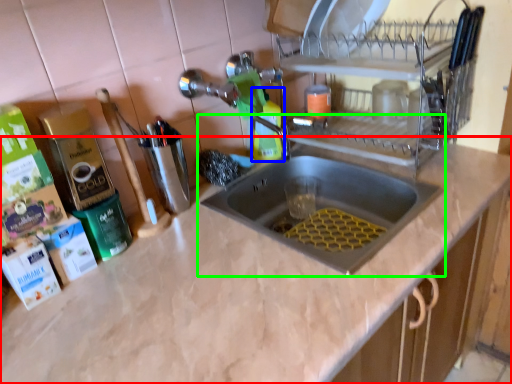
Question: Which object is positioned closest to countertop (highlighted by a red box)? Select from cleaning product (highlighted by a blue box) and sink (highlighted by a green box).

Choices:
 (A) cleaning product
 (B) sink

Answer: (B)